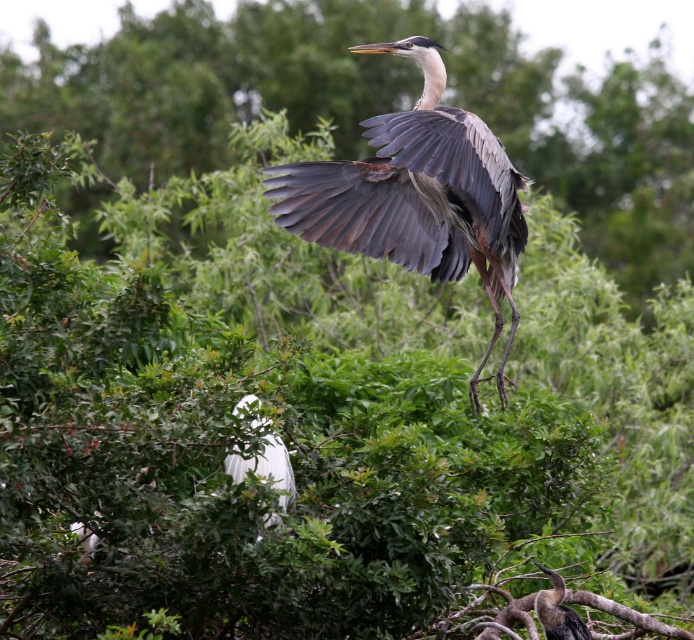
You are a birdwatcher trying to photograph two birds in flight. You see a gray feathered heron at center and a white feathered bird at center. Can you fit both birds in your camera frame if your camera has a 2 meter field of view?

The distance between the gray feathered heron at center and the white feathered bird at center is 3.18 meters. Since your camera has a 2 meter field of view, you cannot fit both birds in the frame as the distance between them exceeds the camera field of view.

Based on the scene description, can you determine if the white feathered bird at center is wider than the dark brown feathers at center?

The white feathered bird at center is wider than dark brown feathers at center according to the description.

You are a photographer trying to capture the Great Blue Heron in flight. You are standing at the camera position. The heron is at point (239,403). If you want to move closer to the heron by 10 feet, will you be able to get within 20 feet of it?

The point (239,403) is 28.26 feet away from the camera. If you move closer by 10 feet, you will be 18.26 feet away from the heron, which is within the 20 feet distance. Yes, you can get within 20 feet.